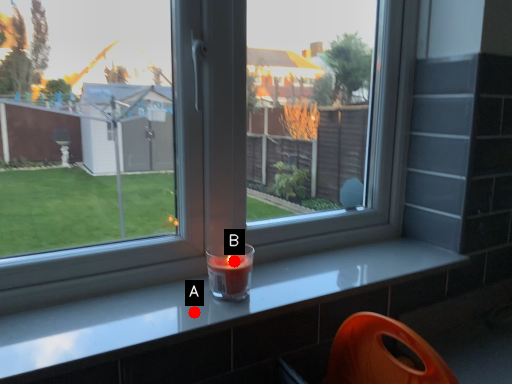
Question: Two points are circled on the image, labeled by A and B beside each circle. Which point is closer to the camera taking this photo?

Choices:
 (A) A is closer
 (B) B is closer

Answer: (A)